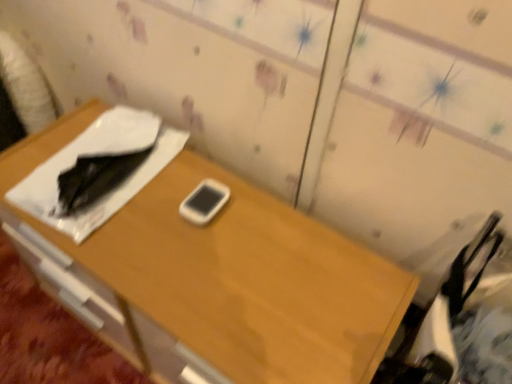
Identify the location of free space in front of white matte mobile phone at center. (200, 268).